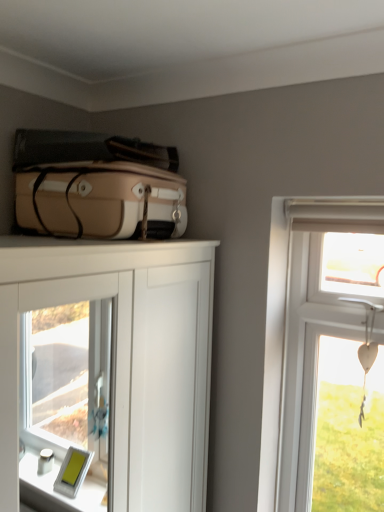
Question: Is white wooden heart at upper right to the left of matte beige suitcase at upper left from the viewer's perspective?

Choices:
 (A) no
 (B) yes

Answer: (A)

Question: From the image's perspective, does white wooden heart at upper right appear higher than matte beige suitcase at upper left?

Choices:
 (A) no
 (B) yes

Answer: (A)

Question: Is white wooden heart at upper right taller than matte beige suitcase at upper left?

Choices:
 (A) yes
 (B) no

Answer: (A)

Question: Considering the relative sizes of white wooden heart at upper right and matte beige suitcase at upper left in the image provided, is white wooden heart at upper right smaller than matte beige suitcase at upper left?

Choices:
 (A) no
 (B) yes

Answer: (B)

Question: Would you say white wooden heart at upper right contains matte beige suitcase at upper left?

Choices:
 (A) no
 (B) yes

Answer: (A)

Question: Could you tell me if white wooden heart at upper right is turned towards matte beige suitcase at upper left?

Choices:
 (A) no
 (B) yes

Answer: (A)

Question: Is white glossy cabinet at center looking in the opposite direction of matte beige suitcase at upper left?

Choices:
 (A) no
 (B) yes

Answer: (A)

Question: Can you confirm if white glossy cabinet at center is thinner than matte beige suitcase at upper left?

Choices:
 (A) no
 (B) yes

Answer: (A)

Question: Can you confirm if white glossy cabinet at center is wider than matte beige suitcase at upper left?

Choices:
 (A) no
 (B) yes

Answer: (B)

Question: Is white glossy cabinet at center to the right of matte beige suitcase at upper left from the viewer's perspective?

Choices:
 (A) no
 (B) yes

Answer: (A)

Question: Is white glossy cabinet at center smaller than matte beige suitcase at upper left?

Choices:
 (A) yes
 (B) no

Answer: (B)

Question: Can you confirm if white glossy cabinet at center is positioned to the left of matte beige suitcase at upper left?

Choices:
 (A) no
 (B) yes

Answer: (B)

Question: From the image's perspective, is white glossy cabinet at center on white wooden heart at upper right?

Choices:
 (A) no
 (B) yes

Answer: (A)